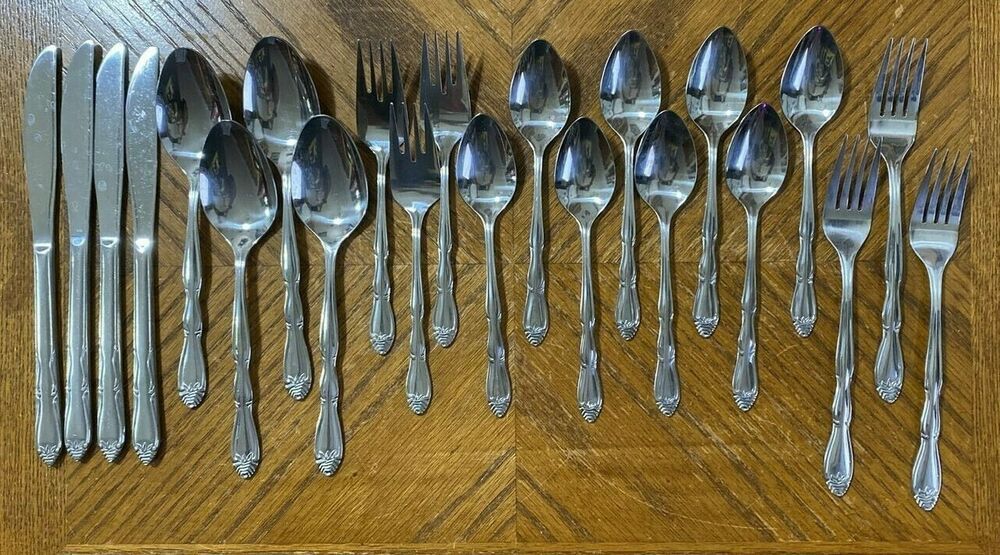
Where is `forks`? This screenshot has height=555, width=1000. forks is located at coordinates (373, 115), (411, 171), (451, 105), (853, 219), (891, 125), (938, 224).